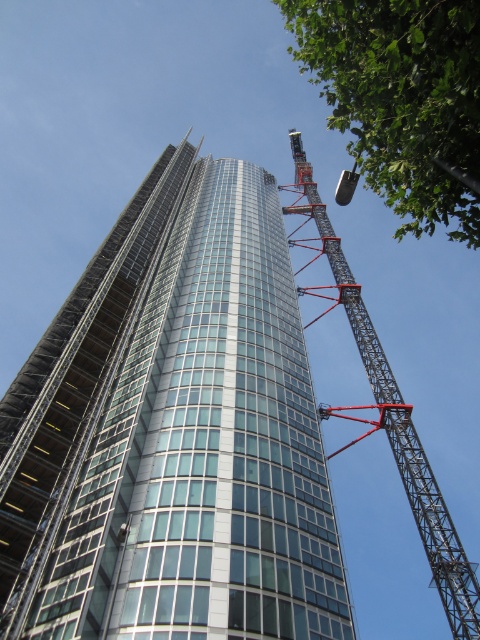
Question: Does metallic gray crane at right have a smaller size compared to metallic gray crane at upper right?

Choices:
 (A) no
 (B) yes

Answer: (A)

Question: Does green leafy tree at upper right appear over metallic gray crane at right?

Choices:
 (A) no
 (B) yes

Answer: (B)

Question: Among these points, which one is nearest to the camera?

Choices:
 (A) (322, 230)
 (B) (355, 173)

Answer: (B)

Question: Which object is closer to the camera taking this photo?

Choices:
 (A) metallic gray crane at right
 (B) glassy steel skyscraper at center
 (C) metallic gray crane at upper right
 (D) green leafy tree at upper right

Answer: (D)

Question: Can you confirm if glassy steel skyscraper at center is positioned to the left of metallic gray crane at upper right?

Choices:
 (A) no
 (B) yes

Answer: (B)

Question: Considering the real-world distances, which object is closest to the green leafy tree at upper right?

Choices:
 (A) glassy steel skyscraper at center
 (B) metallic gray crane at right
 (C) metallic gray crane at upper right

Answer: (B)